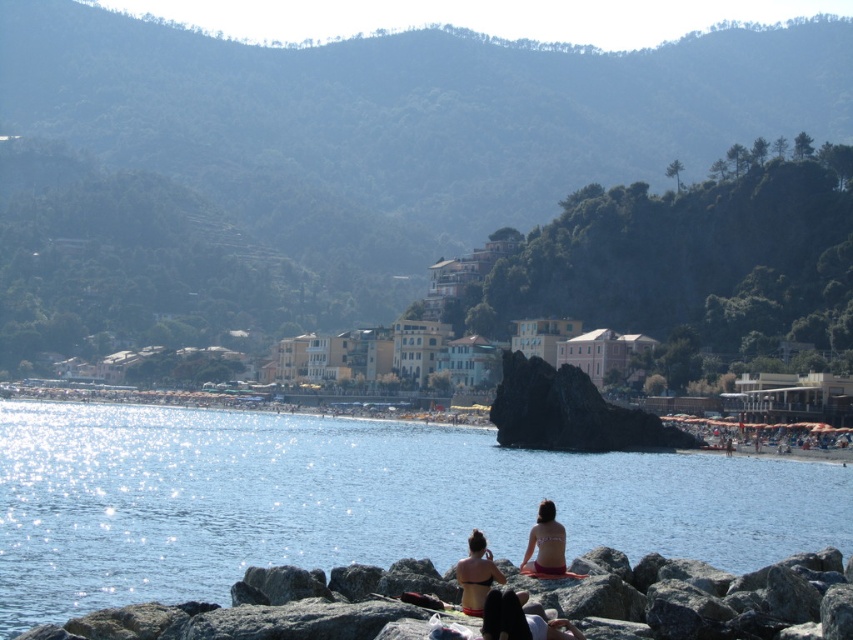
Which is above, blue water at center or beige bikini at lower center?

beige bikini at lower center is above.

The height and width of the screenshot is (640, 853). What are the coordinates of `blue water at center` in the screenshot? It's located at (349, 500).

The height and width of the screenshot is (640, 853). Identify the location of blue water at center. (349, 500).

Is matte black bikini top at center above beige bikini at lower center?

Incorrect, matte black bikini top at center is not positioned above beige bikini at lower center.

Does matte black bikini top at center have a greater width compared to beige bikini at lower center?

In fact, matte black bikini top at center might be narrower than beige bikini at lower center.

Does point (460, 557) lie in front of point (555, 520)?

No, it is behind (555, 520).

Where is `matte black bikini top at center`? Image resolution: width=853 pixels, height=640 pixels. matte black bikini top at center is located at coordinates (476, 573).

Which is behind, point (152, 593) or point (492, 563)?

The point (152, 593) is behind.

Is blue water at center shorter than matte black bikini top at center?

In fact, blue water at center may be taller than matte black bikini top at center.

Between point (103, 456) and point (474, 534), which one is positioned behind?

Point (103, 456)

Where is `blue water at center`? blue water at center is located at coordinates (349, 500).